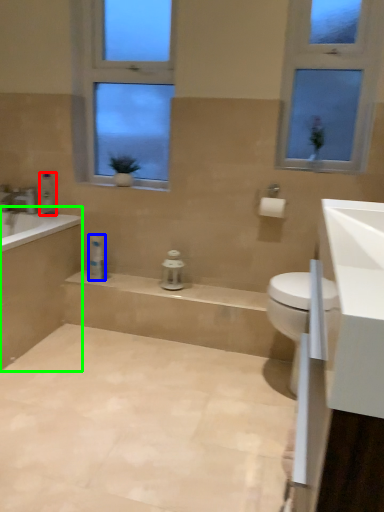
Question: Which is farther away from toiletry (highlighted by a red box)? toiletry (highlighted by a blue box) or bath (highlighted by a green box)?

Choices:
 (A) toiletry
 (B) bath

Answer: (B)